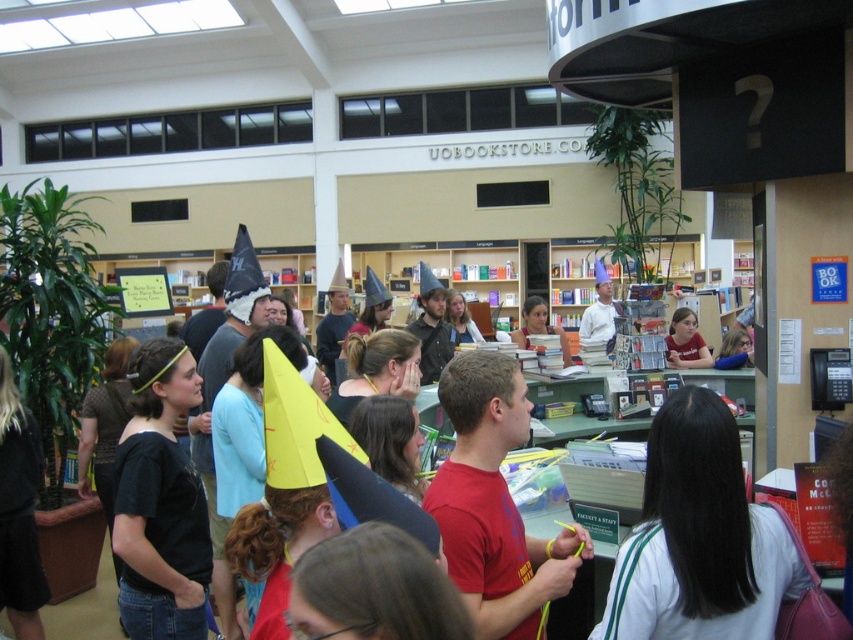
Can you confirm if red matte shirt at center is taller than matte blue shirt at center?

Yes, red matte shirt at center is taller than matte blue shirt at center.

Find the location of `red matte shirt at center`. red matte shirt at center is located at coordinates (494, 502).

Find the location of a particular element. red matte shirt at center is located at coordinates (494, 502).

Is white matte shirt at center to the left of matte blue shirt at center from the viewer's perspective?

Correct, you'll find white matte shirt at center to the left of matte blue shirt at center.

Which is above, white matte shirt at center or matte blue shirt at center?

matte blue shirt at center is above.

Between point (729, 588) and point (688, 344), which one is positioned behind?

Point (688, 344)

Find the location of a particular element. The image size is (853, 640). white matte shirt at center is located at coordinates (699, 538).

In the scene shown: Can you confirm if white matte shirt at center is wider than red matte shirt at center?

Yes.

Is white matte shirt at center positioned behind red matte shirt at center?

No.

The width and height of the screenshot is (853, 640). I want to click on white matte shirt at center, so click(699, 538).